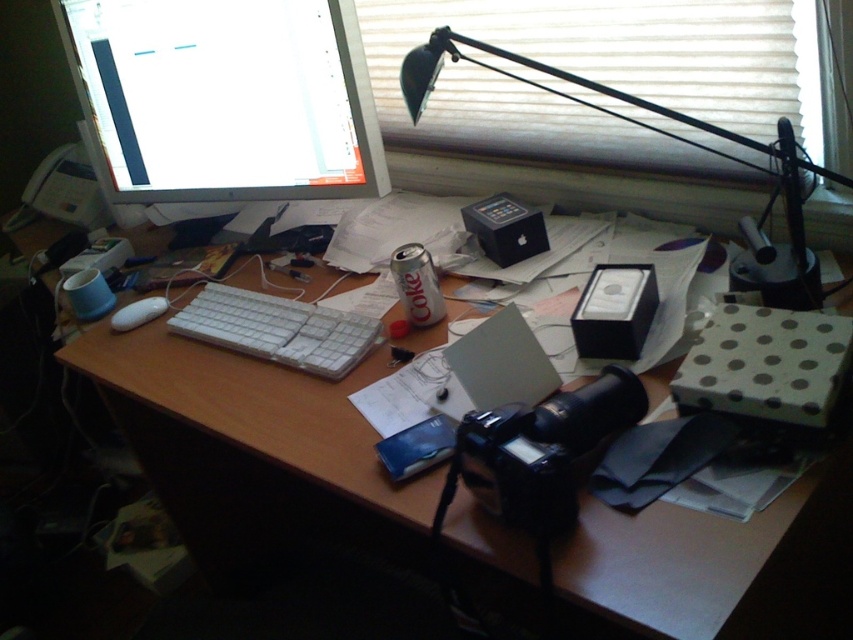
Question: Is wooden desk at center to the right of matte white monitor at upper left from the viewer's perspective?

Choices:
 (A) yes
 (B) no

Answer: (A)

Question: Can you confirm if wooden desk at center is positioned above white matte mouse at left?

Choices:
 (A) yes
 (B) no

Answer: (B)

Question: Among these points, which one is farthest from the camera?

Choices:
 (A) (434, 48)
 (B) (267, 296)

Answer: (B)

Question: Which point is farther from the camera taking this photo?

Choices:
 (A) (442, 120)
 (B) (148, 65)
 (C) (306, 348)

Answer: (A)

Question: Is wooden desk at center smaller than white matte mouse at left?

Choices:
 (A) yes
 (B) no

Answer: (B)

Question: Among these objects, which one is farthest from the camera?

Choices:
 (A) white matte mouse at left
 (B) wooden desk at center

Answer: (A)